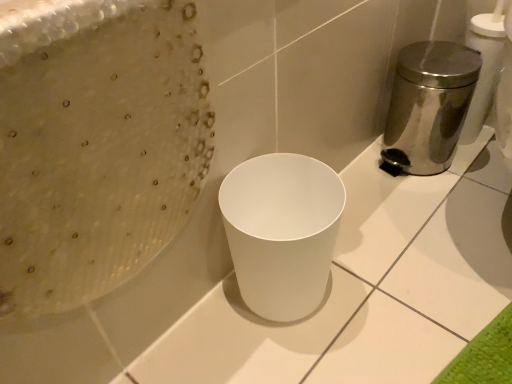
I want to click on vacant area to the left of white matte waste container at center, so click(198, 331).